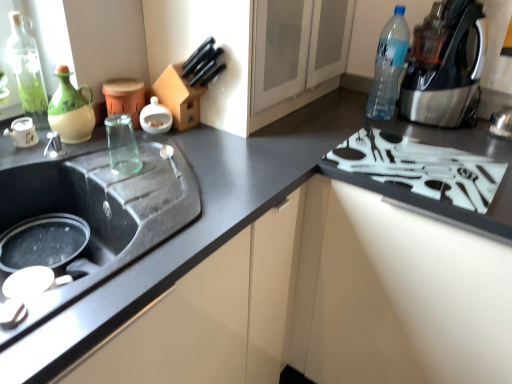
Identify the location of vacant area that is in front of green matte teapot at left. The image size is (512, 384). (71, 159).